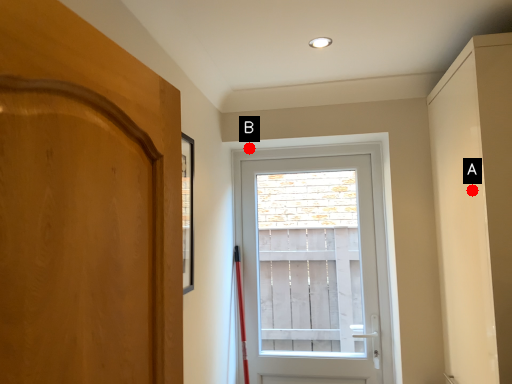
Question: Two points are circled on the image, labeled by A and B beside each circle. Which point is farther to the camera?

Choices:
 (A) A is further
 (B) B is further

Answer: (B)